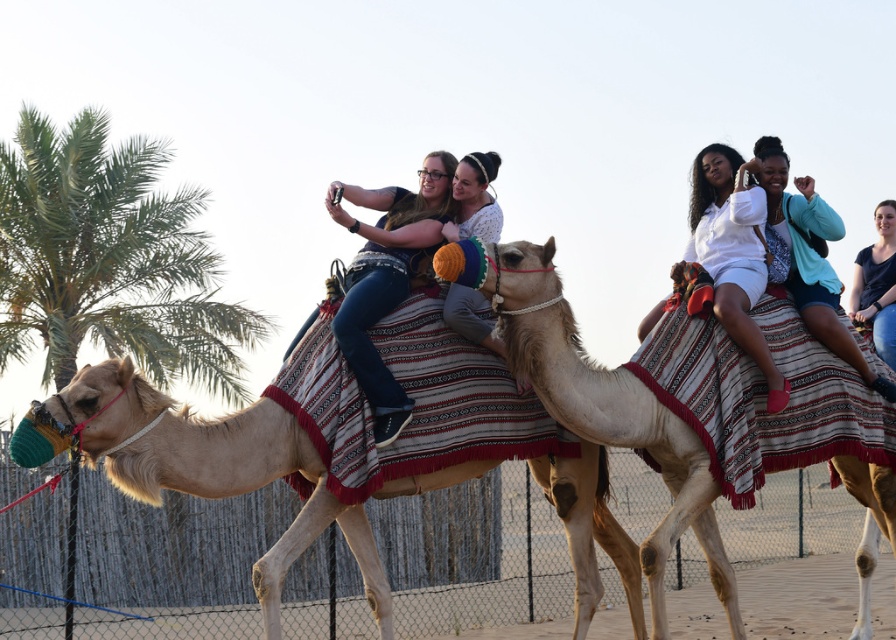
Question: From the image, what is the correct spatial relationship of light beige camel at center in relation to white matte shirt at upper center?

Choices:
 (A) above
 (B) below

Answer: (B)

Question: Based on their relative distances, which object is farther from the blue fabric camel at right?

Choices:
 (A) light beige fabric camel at center
 (B) white cotton shirt at upper right
 (C) white matte shirt at upper center
 (D) light beige camel at center

Answer: (D)

Question: Which object is positioned farthest from the light beige fabric camel at center?

Choices:
 (A) white cotton shirt at upper right
 (B) light beige camel at center

Answer: (A)

Question: Which is farther from the light beige camel at center?

Choices:
 (A) white cotton shirt at upper right
 (B) blue fabric camel at right
 (C) green leafy palm tree at left
 (D) light beige fabric camel at center

Answer: (C)

Question: Does green leafy palm tree at left have a larger size compared to white cotton shirt at upper right?

Choices:
 (A) no
 (B) yes

Answer: (B)

Question: Is light beige camel at center bigger than light beige fabric camel at center?

Choices:
 (A) no
 (B) yes

Answer: (B)